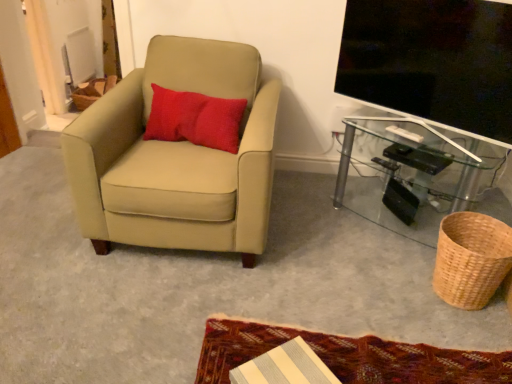
This screenshot has width=512, height=384. I want to click on vacant space that is in between transparent glass table at lower right and textured woolen mat at lower center, so click(348, 276).